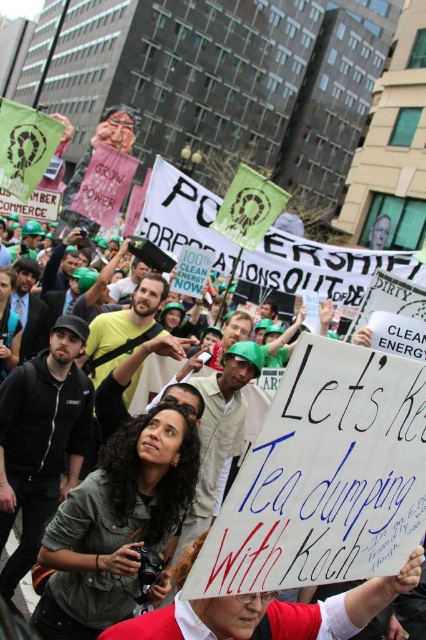
Who is positioned more to the right, matte gray shirt at center or matte black jacket at center?

Positioned to the right is matte gray shirt at center.

Is matte gray shirt at center above matte black jacket at center?

Actually, matte gray shirt at center is below matte black jacket at center.

Identify the location of matte gray shirt at center. (117, 524).

Is white paper sign at center in front of matte black jacket at center?

Yes, white paper sign at center is in front of matte black jacket at center.

Can you confirm if white paper sign at center is thinner than matte black jacket at center?

In fact, white paper sign at center might be wider than matte black jacket at center.

Consider the image. Who is more forward, (238, 620) or (6, 372)?

Point (238, 620) is more forward.

Locate an element on the screen. Image resolution: width=426 pixels, height=640 pixels. white paper sign at center is located at coordinates (265, 611).

Does matte gray shirt at center have a lesser height compared to white paper sign at center?

Yes, matte gray shirt at center is shorter than white paper sign at center.

Is matte gray shirt at center wider than white paper sign at center?

Incorrect, matte gray shirt at center's width does not surpass white paper sign at center's.

Between point (55, 525) and point (333, 637), which one is positioned behind?

Point (55, 525)

Identify the location of matte gray shirt at center. (117, 524).